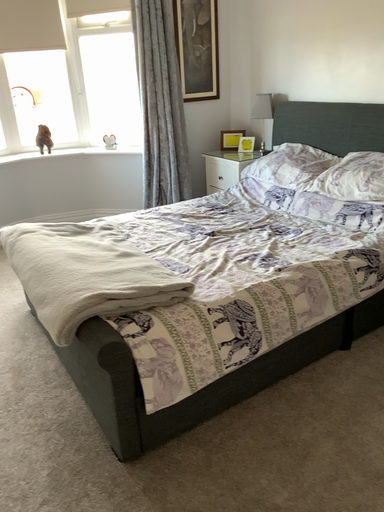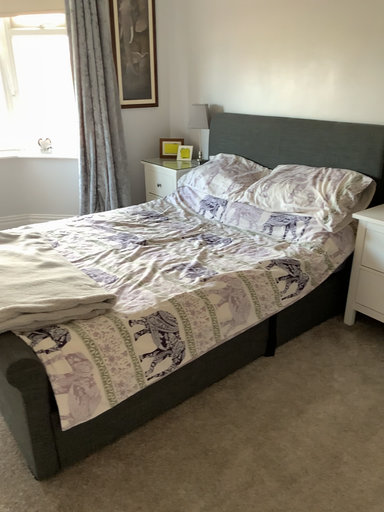
Question: Which way did the camera rotate in the video?

Choices:
 (A) rotated right
 (B) rotated left

Answer: (A)